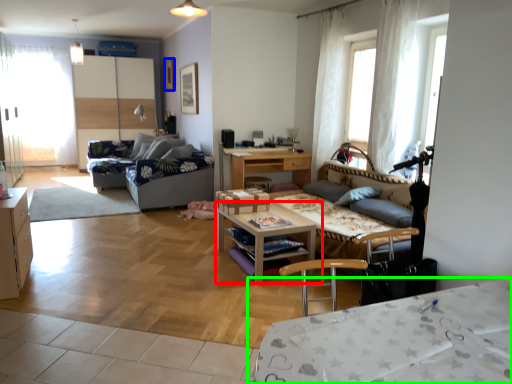
Question: Which object is the farthest from table (highlighted by a red box)? Choose among these: picture frame (highlighted by a blue box) or desk (highlighted by a green box).

Choices:
 (A) picture frame
 (B) desk

Answer: (A)